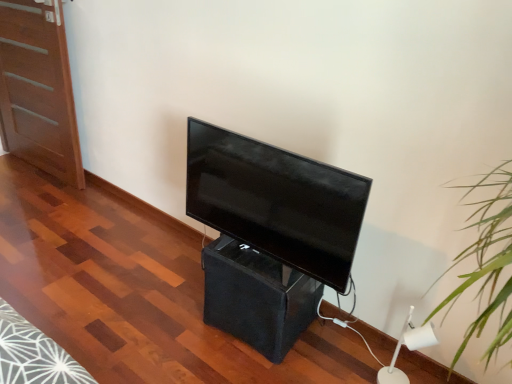
This screenshot has height=384, width=512. Find the location of `free point in front of black fabric speaker at center`. free point in front of black fabric speaker at center is located at coordinates (254, 365).